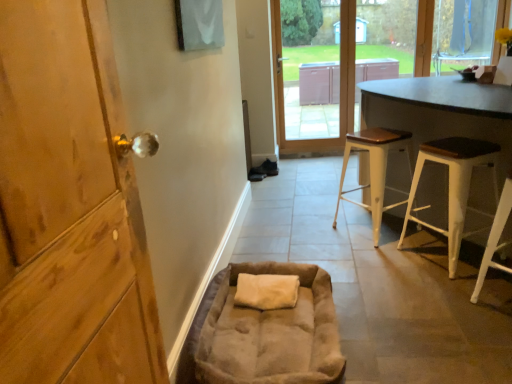
Question: From a real-world perspective, relative to white wood stool at center, positioned as the 1th stool in back-to-front order, is suede-like beige bean bag chair at lower center vertically above or below?

Choices:
 (A) below
 (B) above

Answer: (A)

Question: Would you say suede-like beige bean bag chair at lower center is inside or outside white wood stool at center, positioned as the 1th stool in back-to-front order?

Choices:
 (A) outside
 (B) inside

Answer: (A)

Question: Estimate the real-world distances between objects in this image. Which object is closer to the white wood stool at lower right, the first stool in the front-to-back sequence?

Choices:
 (A) white wood stool at right, placed as the 2th stool when sorted from front to back
 (B) matte gray table at upper right
 (C) transparent glass window at upper right
 (D) white wood stool at center, the third stool in the front-to-back sequence
 (E) wooden door at left

Answer: (A)

Question: Based on their relative distances, which object is nearer to the white wood stool at right, which is counted as the 2th stool, starting from the back?

Choices:
 (A) matte gray table at upper right
 (B) white wood stool at lower right, the first stool in the front-to-back sequence
 (C) dark brown wood table at right
 (D) wooden door at left
 (E) transparent glass window at upper right

Answer: (C)